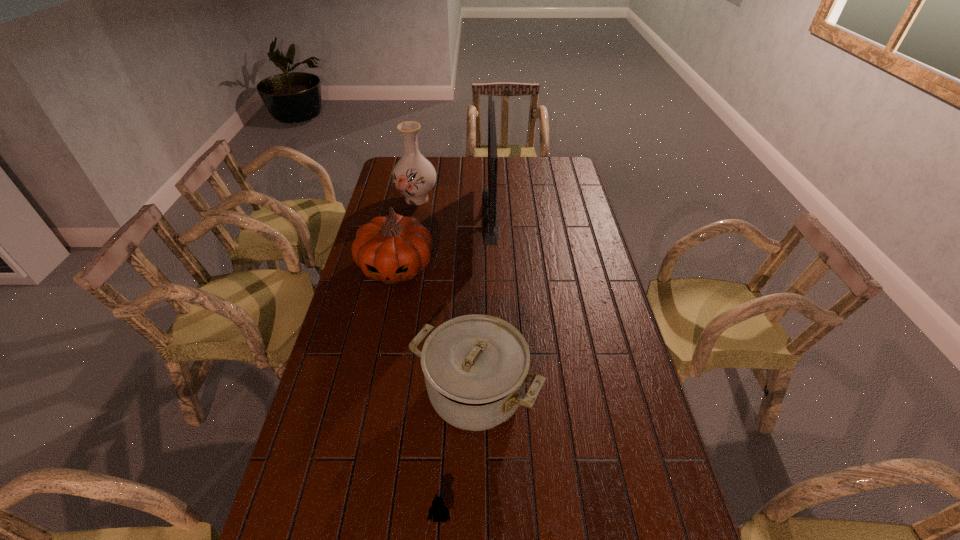
The height and width of the screenshot is (540, 960). What are the coordinates of `free spot that satisfies the following two spatial constraints: 1. on the front-facing side of the monitor; 2. on the face of the pumpkin` in the screenshot? It's located at (492, 267).